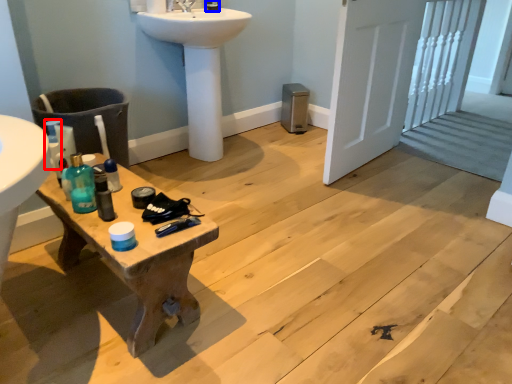
Question: Which point is further to the camera, bottle (highlighted by a red box) or toiletry (highlighted by a blue box)?

Choices:
 (A) bottle
 (B) toiletry

Answer: (B)